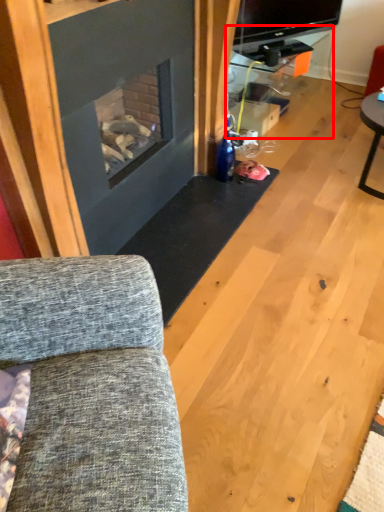
Question: From the image's perspective, where is entertainment center (annotated by the red box) located in relation to studio couch in the image?

Choices:
 (A) above
 (B) below

Answer: (A)